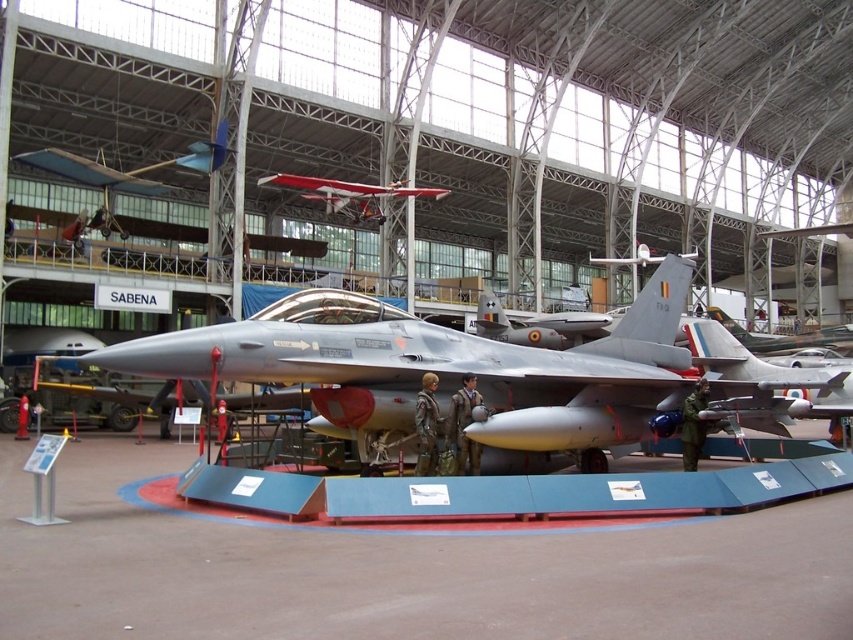
Question: Is silver metallic fighter jet at center positioned before red matte biplane at upper center?

Choices:
 (A) yes
 (B) no

Answer: (A)

Question: Is silver metallic fighter jet at center positioned behind red matte biplane at upper center?

Choices:
 (A) yes
 (B) no

Answer: (B)

Question: Among these objects, which one is nearest to the camera?

Choices:
 (A) silver metallic fighter jet at center
 (B) red matte biplane at upper center

Answer: (A)

Question: Among these points, which one is farthest from the camera?

Choices:
 (A) (331, 189)
 (B) (184, 332)

Answer: (A)

Question: Is silver metallic fighter jet at center positioned behind red matte biplane at upper center?

Choices:
 (A) yes
 (B) no

Answer: (B)